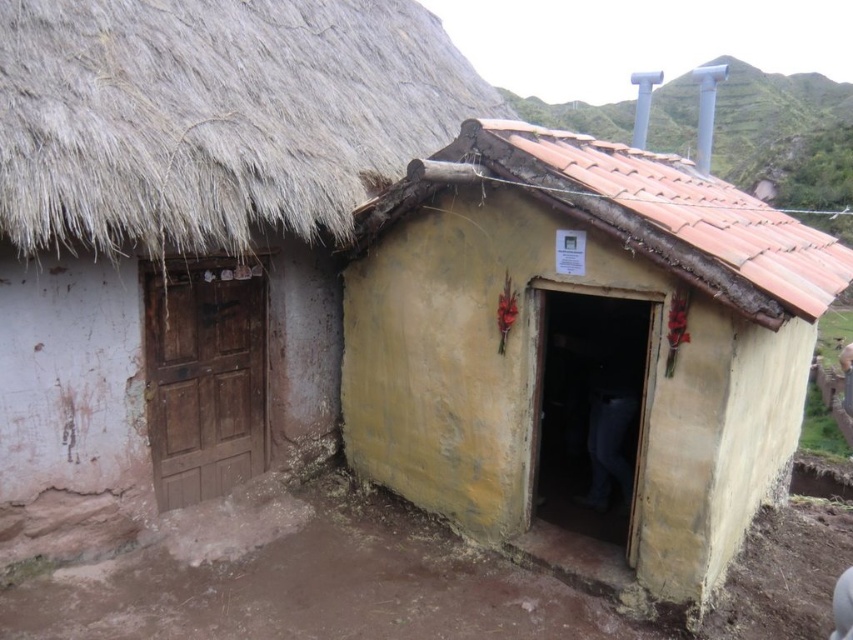
Question: Considering the relative positions of brown clay mud at lower center and terracotta tiled roof at center in the image provided, where is brown clay mud at lower center located with respect to terracotta tiled roof at center?

Choices:
 (A) below
 (B) above

Answer: (A)

Question: Which object is closer to the camera taking this photo?

Choices:
 (A) thatched straw roof at upper left
 (B) terracotta tiled roof at center

Answer: (A)

Question: Which point is farther from the camera taking this photo?

Choices:
 (A) (663, 632)
 (B) (515, 164)
 (C) (666, 228)

Answer: (A)

Question: Does yellow mud hut at center appear on the right side of brown clay mud at lower center?

Choices:
 (A) no
 (B) yes

Answer: (B)

Question: Is yellow mud hut at center below brown clay mud at lower center?

Choices:
 (A) yes
 (B) no

Answer: (B)

Question: Which object is the closest to the yellow mud hut at center?

Choices:
 (A) thatched straw roof at upper left
 (B) terracotta tiled roof at center
 (C) brown clay mud at lower center

Answer: (B)